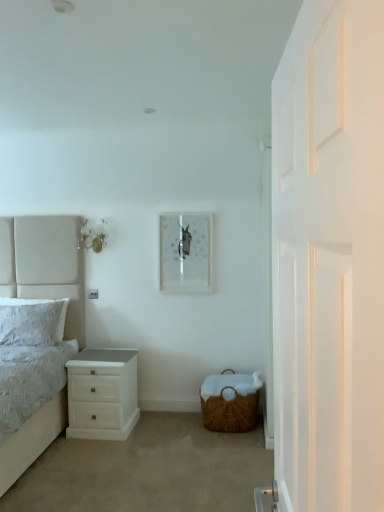
Question: Can you confirm if woven brown basket at lower right is thinner than matte white picture frame at center?

Choices:
 (A) no
 (B) yes

Answer: (A)

Question: Is matte white picture frame at center completely or partially inside woven brown basket at lower right?

Choices:
 (A) no
 (B) yes

Answer: (A)

Question: Can you confirm if woven brown basket at lower right is shorter than matte white picture frame at center?

Choices:
 (A) no
 (B) yes

Answer: (B)

Question: From the image's perspective, is woven brown basket at lower right on top of matte white picture frame at center?

Choices:
 (A) no
 (B) yes

Answer: (A)

Question: Does woven brown basket at lower right lie behind matte white picture frame at center?

Choices:
 (A) yes
 (B) no

Answer: (B)

Question: Would you say white wooden door at right is inside or outside white textured pillow at left?

Choices:
 (A) inside
 (B) outside

Answer: (B)

Question: Is point (294, 505) closer or farther from the camera than point (48, 310)?

Choices:
 (A) farther
 (B) closer

Answer: (B)

Question: Is white wooden door at right bigger or smaller than white textured pillow at left?

Choices:
 (A) big
 (B) small

Answer: (A)

Question: From their relative heights in the image, would you say white wooden door at right is taller or shorter than white textured pillow at left?

Choices:
 (A) tall
 (B) short

Answer: (A)

Question: Considering the positions of point (238, 418) and point (163, 272), is point (238, 418) closer or farther from the camera than point (163, 272)?

Choices:
 (A) farther
 (B) closer

Answer: (B)

Question: Is woven brown basket at lower right inside the boundaries of matte white picture frame at center, or outside?

Choices:
 (A) inside
 (B) outside

Answer: (B)

Question: In terms of height, does woven brown basket at lower right look taller or shorter compared to matte white picture frame at center?

Choices:
 (A) tall
 (B) short

Answer: (B)

Question: In the image, is woven brown basket at lower right positioned in front of or behind matte white picture frame at center?

Choices:
 (A) front
 (B) behind

Answer: (A)

Question: Considering the positions of point (119, 423) and point (173, 280), is point (119, 423) closer or farther from the camera than point (173, 280)?

Choices:
 (A) farther
 (B) closer

Answer: (B)

Question: Based on their sizes in the image, would you say white glossy chest of drawers at lower left is bigger or smaller than matte white picture frame at center?

Choices:
 (A) small
 (B) big

Answer: (B)